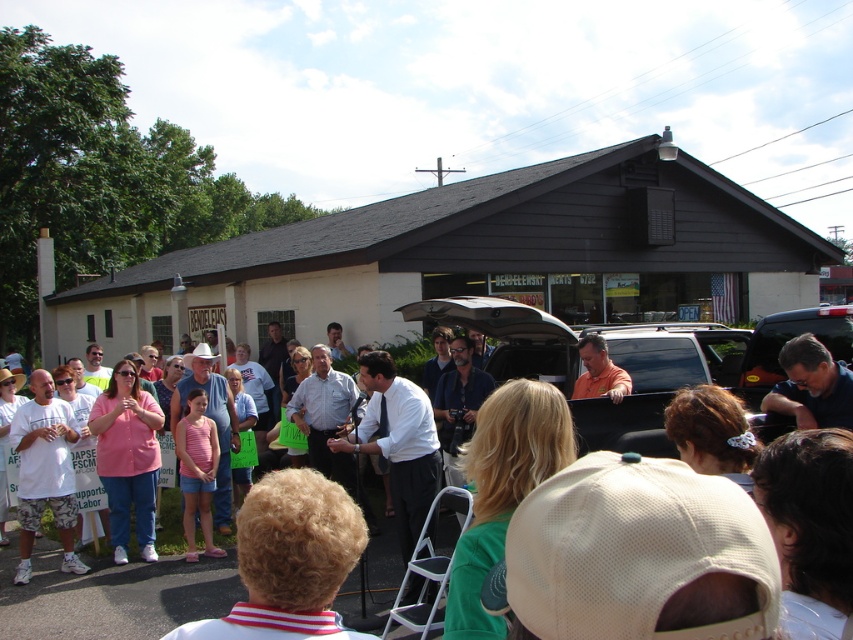
You are a photographer at the event and want to capture both the blonde hair at center and the brown hair at lower right in a single frame. Which person should you focus on first to ensure both are in the frame?

You should focus on the brown hair at lower right first because it is larger and easier to locate, ensuring both the blonde hair at center and the brown hair at lower right are captured in the frame.

You are a photographer at the event and want to capture a photo of the pink fabric dress at center without the blonde hair at center blocking it. How should you adjust your camera angle?

Since the blonde hair at center is above the pink fabric dress at center, you can lower your camera angle to capture the pink fabric dress at center without the hair blocking it.

You are a photographer at the event and want to capture a photo of both the blonde hair at center and the pink fabric dress at center. However, you need to ensure that neither is blocking the other. Based on the scene description, where should you position yourself to achieve this?

The blonde hair at center is in front of the pink fabric dress at center. To capture both without obstruction, position yourself so that the pink fabric dress at center is in front of the blonde hair at center. However, according to the description, the blonde hair is already in front, so adjusting your angle to the side might allow both to be visible without one blocking the other.